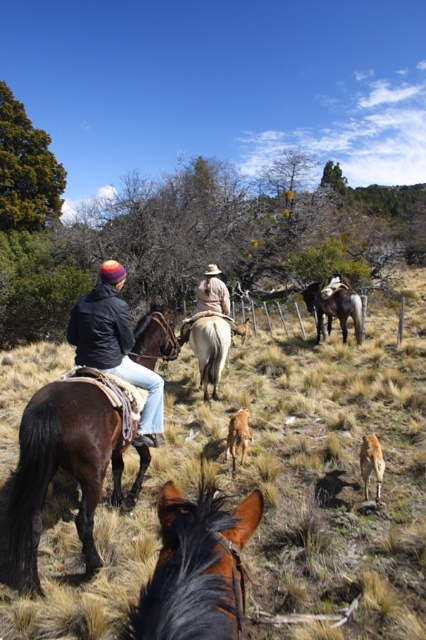
From the picture: You are standing at the point marked as point (311, 564) in the image. A horse is located 3.66 meters away from you. Can you determine if the horse is closer to you than the wooden fence?

The point (311, 564) and viewer are 3.66 meters apart. Since the horse is 3.66 meters away from you, the horse is exactly at your location, which is not possible. Therefore, there might be an error in the distance measurement or the horse is not positioned as described.

You are a photographer trying to capture a shot of the brown rough horse at upper left and the matte black jacket at left. Which object is positioned to the right side of the other?

The brown rough horse at upper left is positioned to the right of matte black jacket at left.